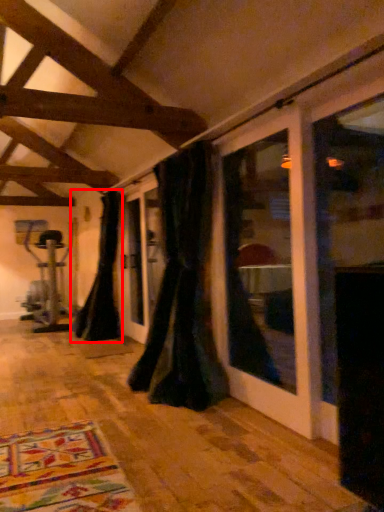
Question: Where is curtain (annotated by the red box) located in relation to curtain in the image?

Choices:
 (A) right
 (B) left

Answer: (B)